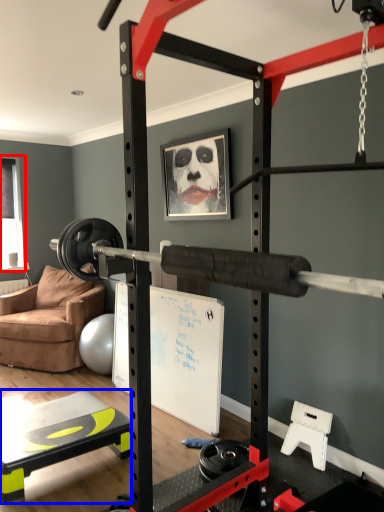
Question: Which object is closer to the camera taking this photo, window screen (highlighted by a red box) or table (highlighted by a blue box)?

Choices:
 (A) window screen
 (B) table

Answer: (B)